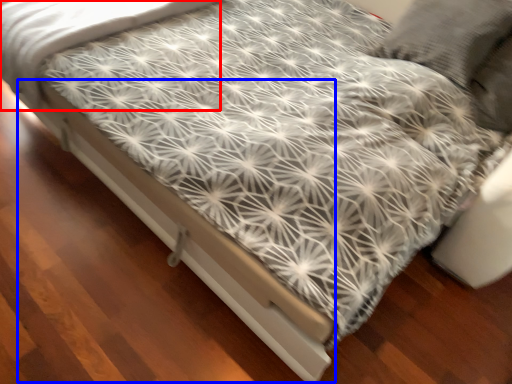
Question: Which point is closer to the camera, sheet (highlighted by a red box) or bed frame (highlighted by a blue box)?

Choices:
 (A) sheet
 (B) bed frame

Answer: (B)